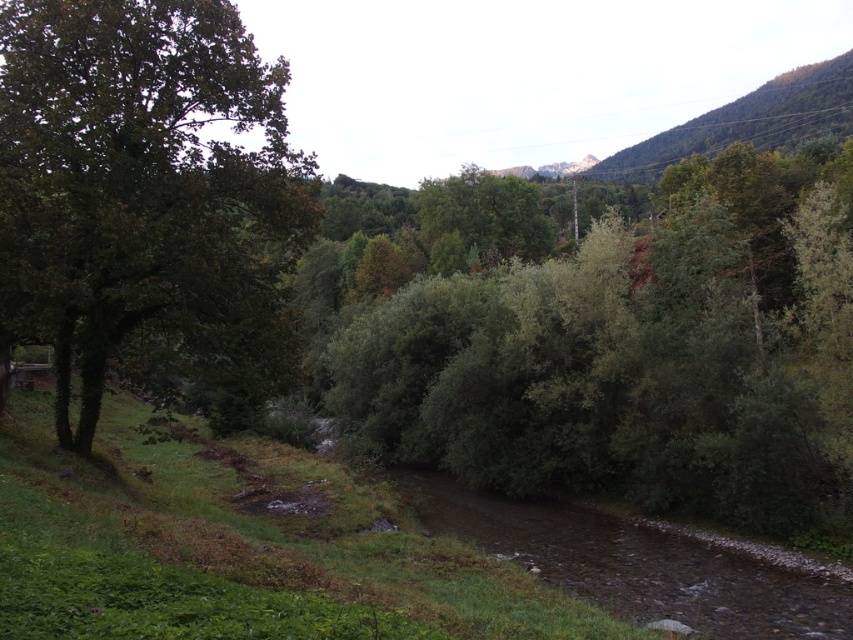
Between green leafy bush at center and green leafy tree at left, which one is positioned higher?

green leafy tree at left is above.

In the scene shown: Does green leafy bush at center appear over green leafy tree at left?

No.

Is point (461, 195) positioned after point (186, 333)?

That is True.

Identify the location of green leafy bush at center. The height and width of the screenshot is (640, 853). click(631, 355).